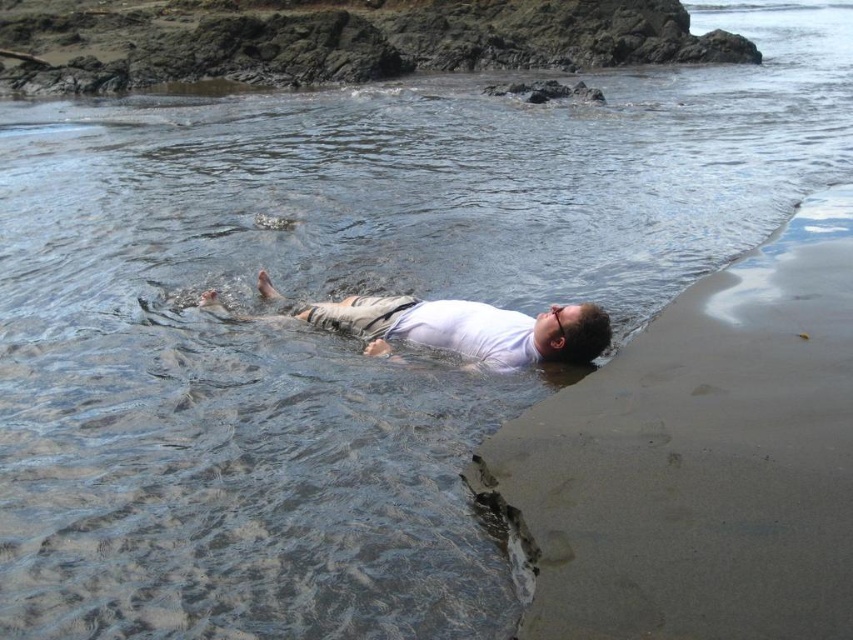
Question: In this image, where is sandy shore at lower right located relative to white matte shirt at center?

Choices:
 (A) above
 (B) below

Answer: (B)

Question: Which point is closer to the camera?

Choices:
 (A) sandy shore at lower right
 (B) white matte shirt at center

Answer: (A)

Question: Is sandy shore at lower right wider than white matte shirt at center?

Choices:
 (A) no
 (B) yes

Answer: (B)

Question: Does sandy shore at lower right have a lesser width compared to white matte shirt at center?

Choices:
 (A) yes
 (B) no

Answer: (B)

Question: Which point is closer to the camera taking this photo?

Choices:
 (A) (x=463, y=342)
 (B) (x=775, y=339)

Answer: (B)